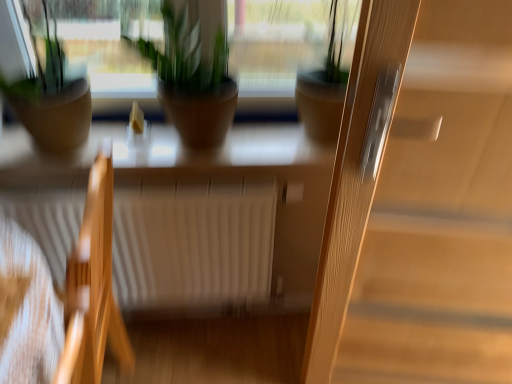
The width and height of the screenshot is (512, 384). I want to click on free region on the left part of green matte plant pot at center, which ranks as the 3th houseplant in left-to-right order, so click(267, 144).